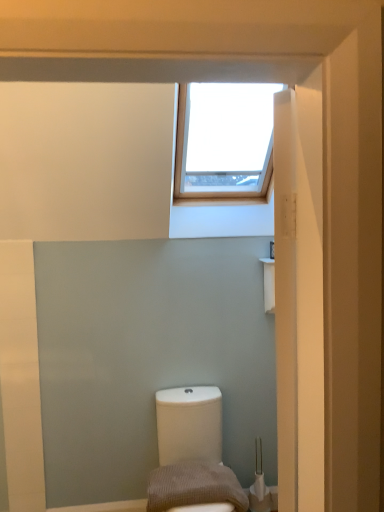
This screenshot has height=512, width=384. What do you see at coordinates (192, 455) in the screenshot?
I see `white glossy toilet at lower center` at bounding box center [192, 455].

I want to click on white glossy toilet at lower center, so (192, 455).

What do you see at coordinates (194, 486) in the screenshot? I see `brown textured pillow at lower center` at bounding box center [194, 486].

At what (x,y) coordinates should I click in order to perform the action: click on brown textured pillow at lower center. Please return your answer as a coordinate pair (x, y). Looking at the image, I should click on (194, 486).

The image size is (384, 512). What are the coordinates of `white glossy toilet at lower center` in the screenshot? It's located at (192, 455).

Considering the relative positions of white glossy toilet at lower center and brown textured pillow at lower center in the image provided, is white glossy toilet at lower center to the left or to the right of brown textured pillow at lower center?

white glossy toilet at lower center is to the right of brown textured pillow at lower center.

In the scene shown: In the image, is white glossy toilet at lower center positioned in front of or behind brown textured pillow at lower center?

white glossy toilet at lower center is in front of brown textured pillow at lower center.

Is point (190, 460) positioned behind point (168, 472)?

Yes, it is.

In the scene shown: From the image's perspective, is white glossy toilet at lower center located above brown textured pillow at lower center?

Incorrect, from the image's perspective, white glossy toilet at lower center is lower than brown textured pillow at lower center.

From a real-world perspective, does white glossy toilet at lower center sit lower than brown textured pillow at lower center?

Yes, from a real-world perspective, white glossy toilet at lower center is below brown textured pillow at lower center.

Is white glossy toilet at lower center wider than brown textured pillow at lower center?

Yes, white glossy toilet at lower center is wider than brown textured pillow at lower center.

Considering the relative sizes of white glossy toilet at lower center and brown textured pillow at lower center in the image provided, is white glossy toilet at lower center shorter than brown textured pillow at lower center?

No.

Does white glossy toilet at lower center have a smaller size compared to brown textured pillow at lower center?

No, white glossy toilet at lower center is not smaller than brown textured pillow at lower center.

Looking at this image, is white glossy toilet at lower center located outside brown textured pillow at lower center?

white glossy toilet at lower center lies outside brown textured pillow at lower center's area.

Are white glossy toilet at lower center and brown textured pillow at lower center far apart?

No, there isn't a large distance between white glossy toilet at lower center and brown textured pillow at lower center.

Is white glossy toilet at lower center turned away from brown textured pillow at lower center?

Correct, white glossy toilet at lower center is looking away from brown textured pillow at lower center.

Consider the image. What's the angular difference between white glossy toilet at lower center and brown textured pillow at lower center's facing directions?

They differ by 0.000451 degrees in their facing directions.

Where is `toilet lying on the right of brown textured pillow at lower center`? The height and width of the screenshot is (512, 384). toilet lying on the right of brown textured pillow at lower center is located at coordinates (192, 455).

Does brown textured pillow at lower center appear on the left side of white glossy toilet at lower center?

Indeed, brown textured pillow at lower center is positioned on the left side of white glossy toilet at lower center.

Is brown textured pillow at lower center in front of or behind white glossy toilet at lower center in the image?

brown textured pillow at lower center is behind white glossy toilet at lower center.

Considering the points (234, 478) and (209, 480), which point is behind, point (234, 478) or point (209, 480)?

The point (234, 478) is more distant.

From the image's perspective, would you say brown textured pillow at lower center is shown under white glossy toilet at lower center?

Actually, brown textured pillow at lower center appears above white glossy toilet at lower center in the image.

From a real-world perspective, which is physically above, brown textured pillow at lower center or white glossy toilet at lower center?

brown textured pillow at lower center.

Which object is thinner, brown textured pillow at lower center or white glossy toilet at lower center?

brown textured pillow at lower center is thinner.

Between brown textured pillow at lower center and white glossy toilet at lower center, which one has less height?

With less height is brown textured pillow at lower center.

Which of these two, brown textured pillow at lower center or white glossy toilet at lower center, is smaller?

brown textured pillow at lower center is smaller.

Would you say brown textured pillow at lower center contains white glossy toilet at lower center?

No, white glossy toilet at lower center is not a part of brown textured pillow at lower center.

Is brown textured pillow at lower center far from white glossy toilet at lower center?

brown textured pillow at lower center is actually quite close to white glossy toilet at lower center.

Is brown textured pillow at lower center facing towards white glossy toilet at lower center?

Yes, brown textured pillow at lower center is oriented towards white glossy toilet at lower center.

What's the angular difference between brown textured pillow at lower center and white glossy toilet at lower center's facing directions?

0.000451 degrees.

How far apart are brown textured pillow at lower center and white glossy toilet at lower center?

brown textured pillow at lower center and white glossy toilet at lower center are 3.12 inches apart from each other.

In order to click on toilet that is on the right side of brown textured pillow at lower center in this screenshot , I will do `click(192, 455)`.

Identify the location of toilet below the brown textured pillow at lower center (from the image's perspective). (192, 455).

Find the location of a particular element. The width and height of the screenshot is (384, 512). pillow above the white glossy toilet at lower center (from a real-world perspective) is located at coordinates (194, 486).